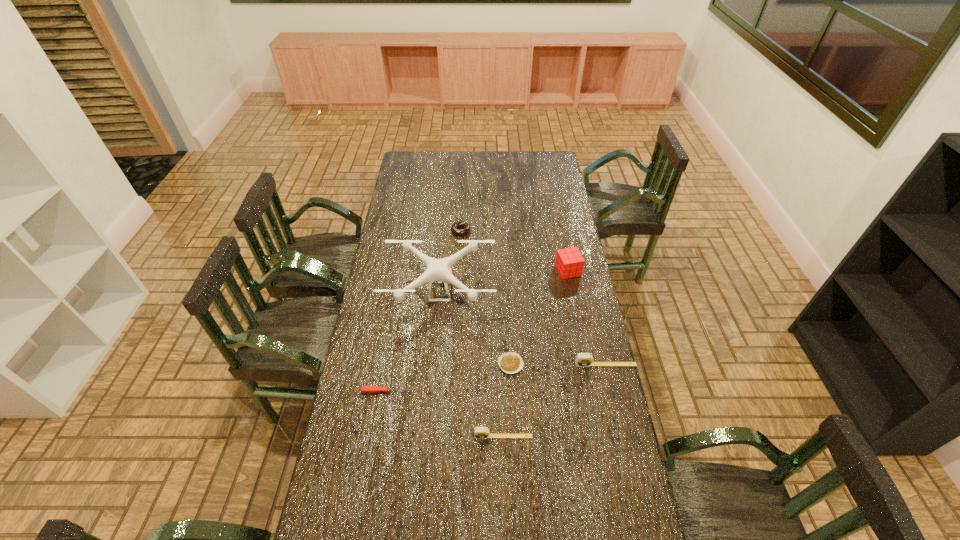
Image resolution: width=960 pixels, height=540 pixels. In order to click on vacant place for an extra tape measure on the left in this screenshot , I will do `click(370, 530)`.